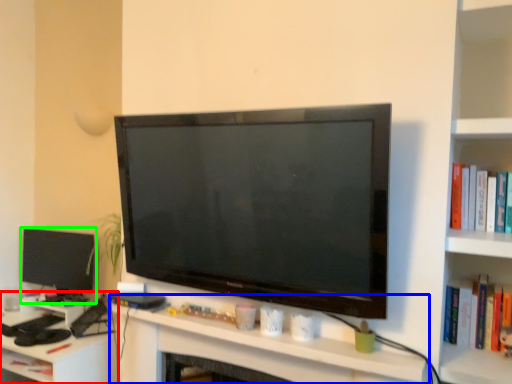
Question: Which object is positioned farthest from computer desk (highlighted by a red box)? Select from computer (highlighted by a blue box) and television (highlighted by a green box).

Choices:
 (A) computer
 (B) television

Answer: (A)